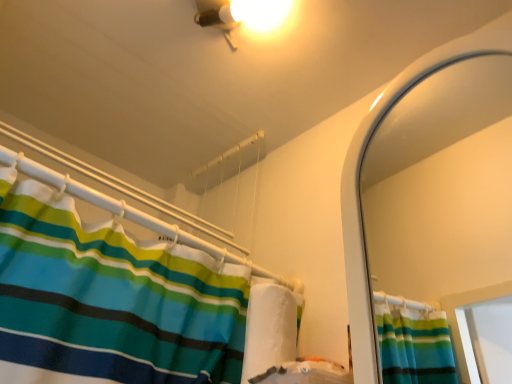
Locate an element on the screen. white glossy mirror at upper right is located at coordinates pyautogui.click(x=442, y=184).

Measure the distance between white glossy mirror at upper right and camera.

The depth of white glossy mirror at upper right is 4.06 feet.

This screenshot has height=384, width=512. What do you see at coordinates (442, 184) in the screenshot?
I see `white glossy mirror at upper right` at bounding box center [442, 184].

Find the location of a particular element. This screenshot has height=384, width=512. white glossy mirror at upper right is located at coordinates (442, 184).